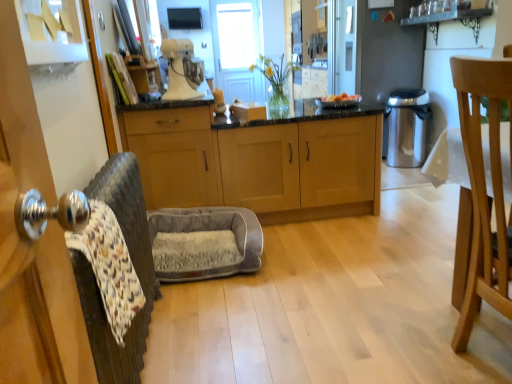
The height and width of the screenshot is (384, 512). In order to click on free space in front of gray plush pet bed at center, the 1th swivel chair from the back in this screenshot , I will do `click(223, 308)`.